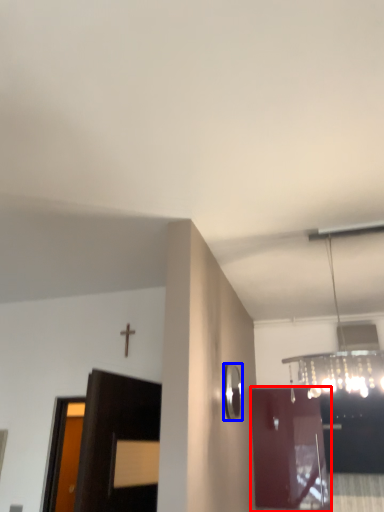
Question: Which object is further to the camera taking this photo, door (highlighted by a red box) or mirror (highlighted by a blue box)?

Choices:
 (A) door
 (B) mirror

Answer: (A)